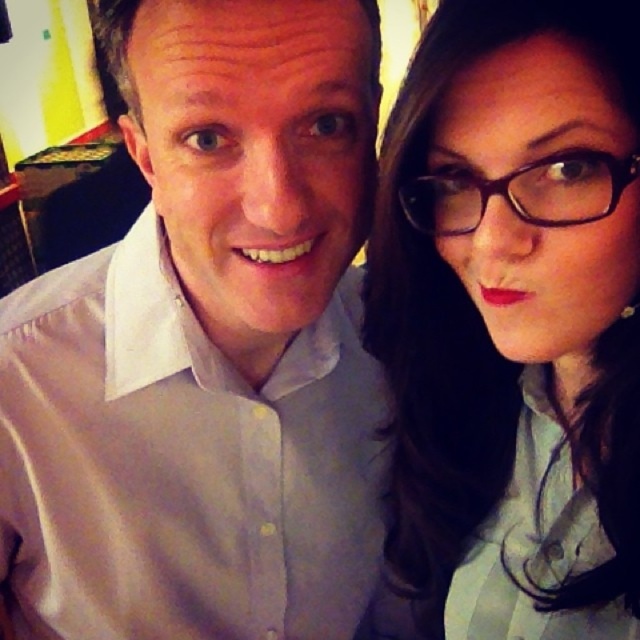
Question: Among these points, which one is nearest to the camera?

Choices:
 (A) (554, 28)
 (B) (608, 189)

Answer: (A)

Question: Is matte black glasses at upper right closer to the viewer compared to black plastic glasses at upper right?

Choices:
 (A) no
 (B) yes

Answer: (B)

Question: Can you confirm if matte black glasses at upper right is wider than black plastic glasses at upper right?

Choices:
 (A) yes
 (B) no

Answer: (A)

Question: Which of the following is the farthest from the observer?

Choices:
 (A) matte black glasses at upper right
 (B) black plastic glasses at upper right

Answer: (B)

Question: Is matte black glasses at upper right positioned behind black plastic glasses at upper right?

Choices:
 (A) yes
 (B) no

Answer: (B)

Question: Which point is farther to the camera?

Choices:
 (A) (422, 198)
 (B) (445, 611)

Answer: (B)